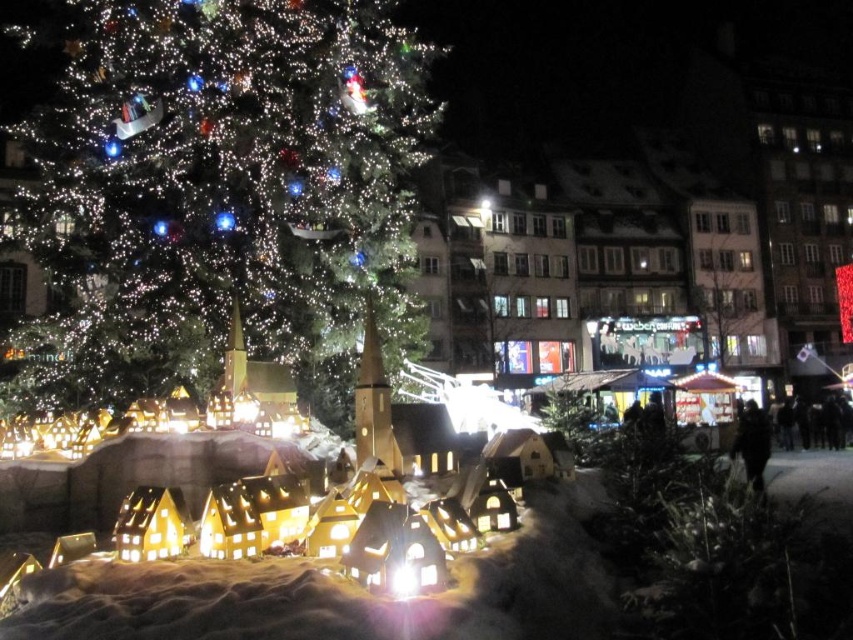
You are standing at the illuminated matte green christmas tree at upper left and want to reach the black fabric person at lower right. The path is clear, but you have a 1.2 meter wide cart. Will the cart fit through the narrowest part of the path?

The distance between the illuminated matte green christmas tree at upper left and the black fabric person at lower right is 38.04 meters. Since the cart is only 1.2 meters wide, it will easily fit through the path as the width is sufficient.

You are standing at the camera position and want to take a photo of the illuminated matte green christmas tree at upper left. If your camera has a maximum focus range of 140 feet, will you be able to focus on the tree?

The illuminated matte green christmas tree at upper left is 144.05 feet from the camera, which exceeds the camera maximum focus range of 140 feet. Therefore, the camera cannot focus on the tree.

You are standing in the winter scene and want to take a photo of the illuminated matte green christmas tree at upper left without the black fabric person at lower right appearing in the shot. How can you adjust your position to achieve this?

Since the illuminated matte green christmas tree at upper left is positioned over the black fabric person at lower right, you should move to the side so that the tree is no longer aligned with the person. This will allow you to capture the tree without the person in the frame.